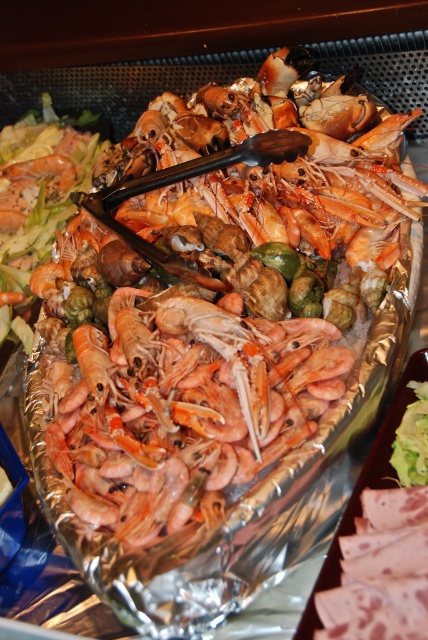
Who is lower down, orange matte shrimp at center or pink matte shrimp at center?

Positioned lower is pink matte shrimp at center.

Is orange matte shrimp at center to the right of pink matte shrimp at center from the viewer's perspective?

Indeed, orange matte shrimp at center is positioned on the right side of pink matte shrimp at center.

Is point (142, 374) positioned after point (202, 308)?

That is False.

Where is `orange matte shrimp at center`? The height and width of the screenshot is (640, 428). orange matte shrimp at center is located at coordinates (214, 292).